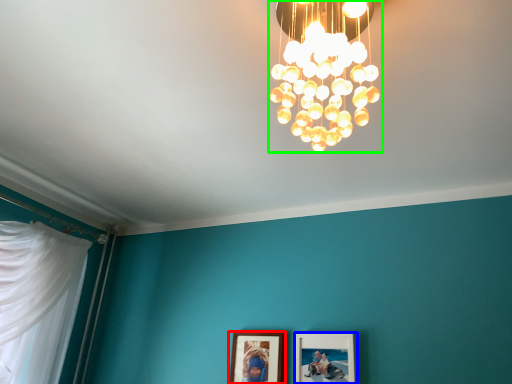
Question: Based on their relative distances, which object is farther from picture frame (highlighted by a red box)? Choose from picture frame (highlighted by a blue box) and lamp (highlighted by a green box).

Choices:
 (A) picture frame
 (B) lamp

Answer: (B)